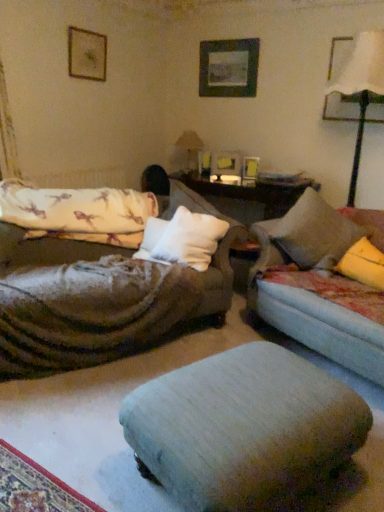
Question: From the image's perspective, does white fabric lampshade at upper right, which ranks as the 1th table lamp in right-to-left order, appear lower than light gray fabric footrest at center?

Choices:
 (A) no
 (B) yes

Answer: (A)

Question: Considering the relative sizes of white fabric lampshade at upper right, the 1th table lamp positioned from the front, and light gray fabric footrest at center in the image provided, is white fabric lampshade at upper right, the 1th table lamp positioned from the front, wider than light gray fabric footrest at center?

Choices:
 (A) no
 (B) yes

Answer: (A)

Question: From the image's perspective, is white fabric lampshade at upper right, arranged as the 2th table lamp when viewed from the left, located above light gray fabric footrest at center?

Choices:
 (A) no
 (B) yes

Answer: (B)

Question: Is white fabric lampshade at upper right, the 1th table lamp positioned from the front, directly adjacent to light gray fabric footrest at center?

Choices:
 (A) no
 (B) yes

Answer: (A)

Question: Does white fabric lampshade at upper right, which ranks as the 1th table lamp in right-to-left order, appear on the right side of light gray fabric footrest at center?

Choices:
 (A) yes
 (B) no

Answer: (A)

Question: Could you tell me if white fabric lampshade at upper right, the 1th table lamp positioned from the front, is turned towards light gray fabric footrest at center?

Choices:
 (A) yes
 (B) no

Answer: (A)

Question: Is fluffy white mattress at left further to camera compared to white fabric lampshade at upper right, which ranks as the 1th table lamp in right-to-left order?

Choices:
 (A) yes
 (B) no

Answer: (A)

Question: Considering the relative sizes of fluffy white mattress at left and white fabric lampshade at upper right, arranged as the 2th table lamp when viewed from the left, in the image provided, is fluffy white mattress at left shorter than white fabric lampshade at upper right, arranged as the 2th table lamp when viewed from the left,?

Choices:
 (A) yes
 (B) no

Answer: (A)

Question: Is white fabric lampshade at upper right, the 1th table lamp positioned from the front, completely or partially inside fluffy white mattress at left?

Choices:
 (A) no
 (B) yes

Answer: (A)

Question: Can you confirm if fluffy white mattress at left is bigger than white fabric lampshade at upper right, which appears as the second table lamp when viewed from the back?

Choices:
 (A) no
 (B) yes

Answer: (A)

Question: Is fluffy white mattress at left looking in the opposite direction of white fabric lampshade at upper right, which ranks as the 1th table lamp in right-to-left order?

Choices:
 (A) yes
 (B) no

Answer: (B)

Question: From a real-world perspective, is fluffy white mattress at left physically above white fabric lampshade at upper right, which ranks as the 1th table lamp in right-to-left order?

Choices:
 (A) yes
 (B) no

Answer: (B)

Question: Is matte beige table lamp at center, which is the 1th table lamp from back to front, looking in the opposite direction of light gray fabric footrest at center?

Choices:
 (A) no
 (B) yes

Answer: (A)